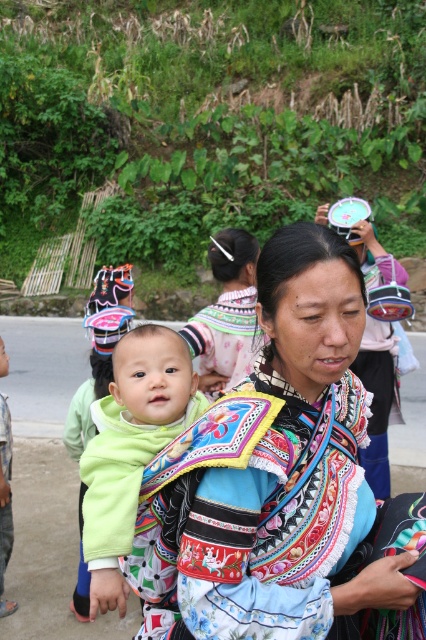
Question: Can you confirm if embroidered fabric baby carrier at center is positioned above green fleece baby at center?

Choices:
 (A) no
 (B) yes

Answer: (B)

Question: Observing the image, what is the correct spatial positioning of embroidered fabric baby carrier at center in reference to green fleece baby at center?

Choices:
 (A) below
 (B) above

Answer: (B)

Question: Which point is closer to the camera?

Choices:
 (A) green fleece baby at center
 (B) embroidered fabric baby carrier at center

Answer: (B)

Question: Which object appears farthest from the camera in this image?

Choices:
 (A) embroidered fabric baby carrier at center
 (B) green fleece baby at center

Answer: (B)

Question: From the image, what is the correct spatial relationship of embroidered fabric baby carrier at center in relation to green fleece baby at center?

Choices:
 (A) left
 (B) right

Answer: (B)